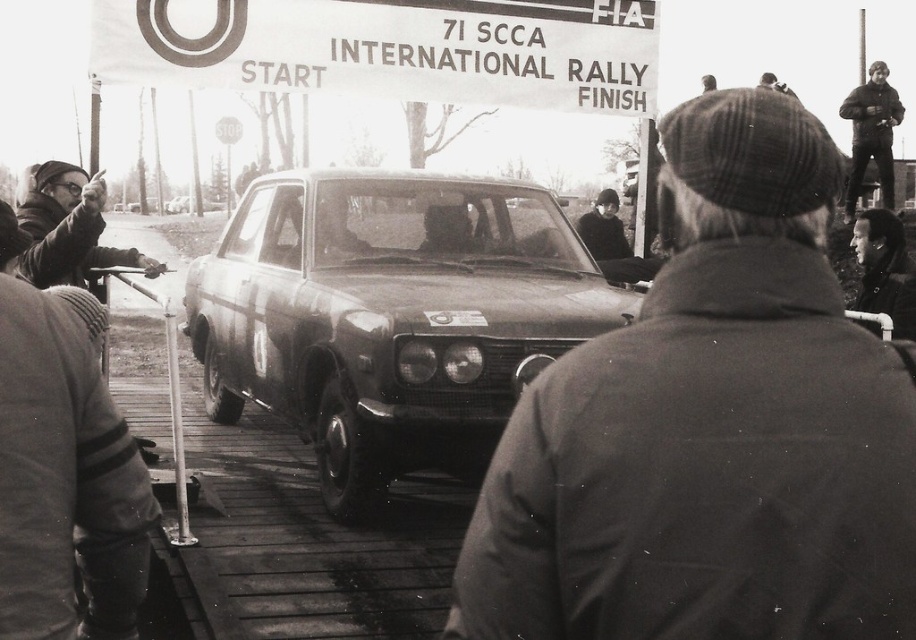
Is matte black jacket at left bigger than smooth black jacket at center?

Actually, matte black jacket at left might be smaller than smooth black jacket at center.

Which is more to the right, matte black jacket at left or smooth black jacket at center?

smooth black jacket at center is more to the right.

In order to click on matte black jacket at left in this screenshot , I will do `click(69, 228)`.

What do you see at coordinates (710, 428) in the screenshot?
I see `coarse woolen cap at center` at bounding box center [710, 428].

Can you confirm if coarse woolen cap at center is wider than metallic silver sedan at center?

In fact, coarse woolen cap at center might be narrower than metallic silver sedan at center.

Between point (820, 266) and point (204, 198), which one is positioned behind?

The point (204, 198) is more distant.

Locate an element on the screen. The width and height of the screenshot is (916, 640). coarse woolen cap at center is located at coordinates (710, 428).

This screenshot has height=640, width=916. I want to click on shiny metallic car at center, so tap(390, 316).

At what (x,y) coordinates should I click in order to perform the action: click on shiny metallic car at center. Please return your answer as a coordinate pair (x, y). This screenshot has width=916, height=640. Looking at the image, I should click on (390, 316).